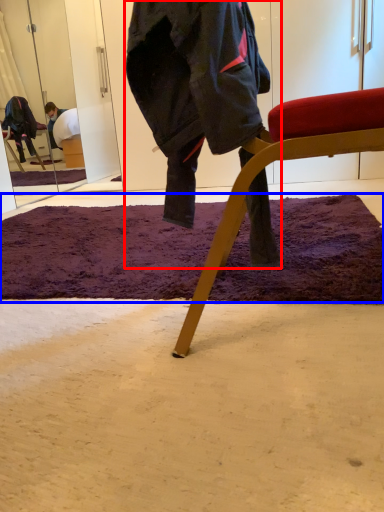
Question: Among these objects, which one is farthest to the camera, person (highlighted by a red box) or mat (highlighted by a blue box)?

Choices:
 (A) person
 (B) mat

Answer: (B)